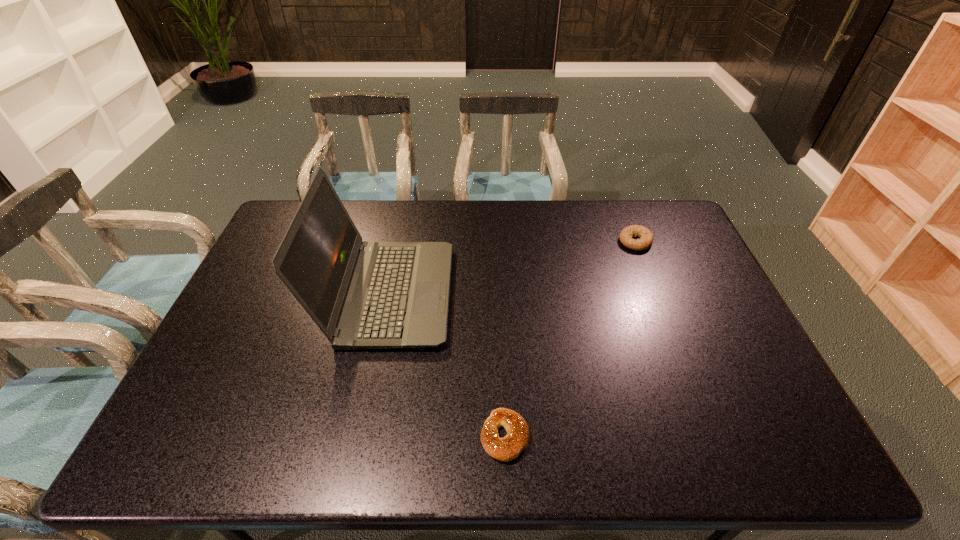
This screenshot has width=960, height=540. Identify the location of laptop_computer. (362, 295).

Identify the location of the leftmost object. (362, 295).

This screenshot has height=540, width=960. In order to click on the farther bagel in this screenshot , I will do `click(646, 239)`.

Identify the location of the right bagel. (646, 239).

Identify the location of the nearest object. (508, 448).

You are a GUI agent. You are given a task and a screenshot of the screen. Output one action in this format:
    pyautogui.click(x=<x>, y=<y>)
    Task: Click on the nearer bagel
    The image size is (960, 540).
    Given the screenshot: What is the action you would take?
    click(x=508, y=448)

This screenshot has height=540, width=960. I want to click on free spot located 0.370m on the screen of the laptop_computer, so click(x=571, y=294).

This screenshot has height=540, width=960. I want to click on vacant region located on the front of the rightmost object, so pyautogui.click(x=658, y=298).

This screenshot has height=540, width=960. What are the coordinates of `free spot located 0.350m on the back of the nearer bagel` in the screenshot? It's located at (499, 305).

Locate an element on the screen. Image resolution: width=960 pixels, height=540 pixels. object present at the far edge is located at coordinates (646, 239).